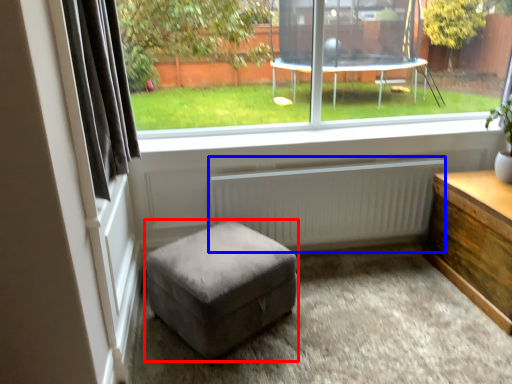
Question: Which point is further to the camera, stool (highlighted by a red box) or radiator (highlighted by a blue box)?

Choices:
 (A) stool
 (B) radiator

Answer: (B)